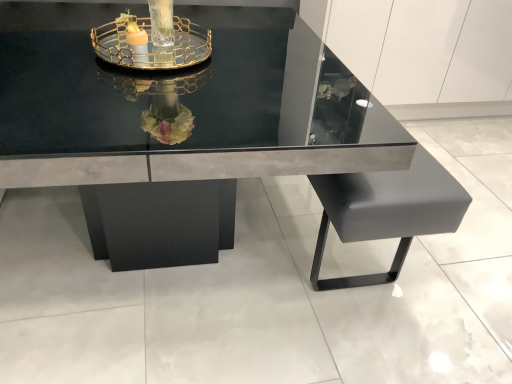
Question: Can you confirm if clear glass tray at upper center is smaller than glossy black table at center?

Choices:
 (A) no
 (B) yes

Answer: (B)

Question: Would you consider clear glass tray at upper center to be distant from glossy black table at center?

Choices:
 (A) yes
 (B) no

Answer: (B)

Question: Is clear glass tray at upper center taller than glossy black table at center?

Choices:
 (A) yes
 (B) no

Answer: (B)

Question: Does clear glass tray at upper center appear on the left side of glossy black table at center?

Choices:
 (A) yes
 (B) no

Answer: (B)

Question: Does clear glass tray at upper center appear on the right side of glossy black table at center?

Choices:
 (A) yes
 (B) no

Answer: (A)

Question: Could glossy black table at center be considered to be inside clear glass tray at upper center?

Choices:
 (A) no
 (B) yes

Answer: (A)

Question: Does glossy black table at center come in front of clear glass tray at upper center?

Choices:
 (A) yes
 (B) no

Answer: (A)

Question: Is glossy black table at center to the left of clear glass tray at upper center from the viewer's perspective?

Choices:
 (A) yes
 (B) no

Answer: (A)

Question: Does glossy black table at center have a smaller size compared to clear glass tray at upper center?

Choices:
 (A) no
 (B) yes

Answer: (A)

Question: Can you confirm if glossy black table at center is bigger than clear glass tray at upper center?

Choices:
 (A) no
 (B) yes

Answer: (B)

Question: From the image's perspective, is glossy black table at center above clear glass tray at upper center?

Choices:
 (A) yes
 (B) no

Answer: (B)

Question: Considering the relative sizes of glossy black table at center and clear glass tray at upper center in the image provided, is glossy black table at center wider than clear glass tray at upper center?

Choices:
 (A) yes
 (B) no

Answer: (A)

Question: Is clear glass tray at upper center bigger or smaller than glossy black table at center?

Choices:
 (A) small
 (B) big

Answer: (A)